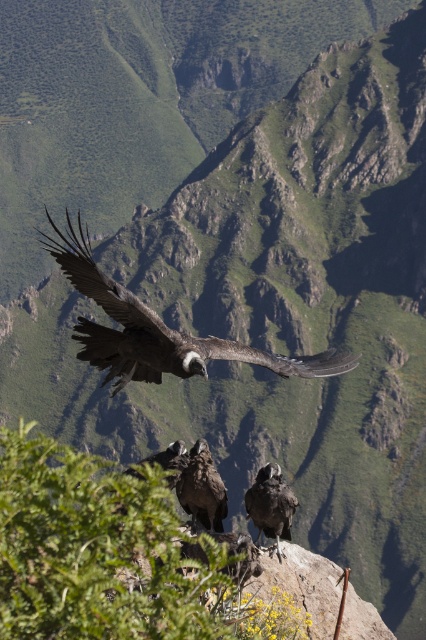
Does point (51, 224) lie in front of point (278, 547)?

No.

Is dark brown feathered eagle at center thinner than dark gray feathers at lower right?

No.

Find the location of `dark brown feathered eagle at center`. dark brown feathered eagle at center is located at coordinates (158, 330).

Find the location of a particular element. The image size is (426, 640). dark brown feathered eagle at center is located at coordinates (158, 330).

Based on the photo, is green leafy shrub at center wider than dark brown feathers at center?

Yes, green leafy shrub at center is wider than dark brown feathers at center.

Who is more forward, (32, 544) or (212, 522)?

Positioned in front is point (32, 544).

Locate an element on the screen. This screenshot has width=426, height=640. green leafy shrub at center is located at coordinates (111, 556).

Which is more to the right, green leafy shrub at center or dark gray feathers at lower right?

From the viewer's perspective, dark gray feathers at lower right appears more on the right side.

Is green leafy shrub at center smaller than dark gray feathers at lower right?

No, green leafy shrub at center is not smaller than dark gray feathers at lower right.

Locate an element on the screen. The image size is (426, 640). green leafy shrub at center is located at coordinates (111, 556).